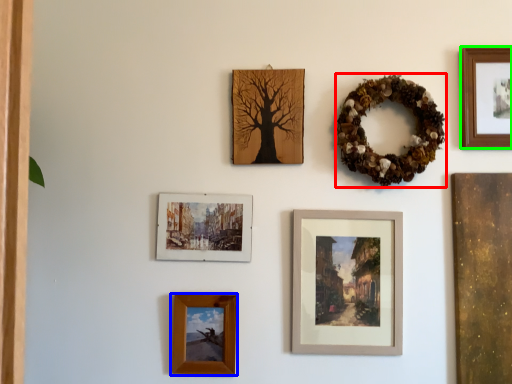
Question: Which object is the farthest from decor (highlighted by a red box)? Choose among these: picture frame (highlighted by a blue box) or picture frame (highlighted by a green box).

Choices:
 (A) picture frame
 (B) picture frame

Answer: (A)